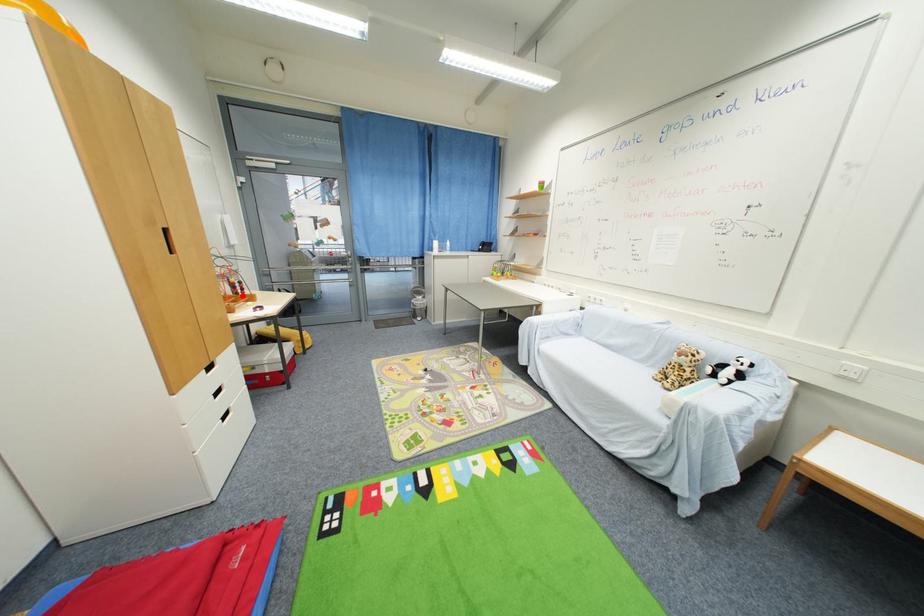
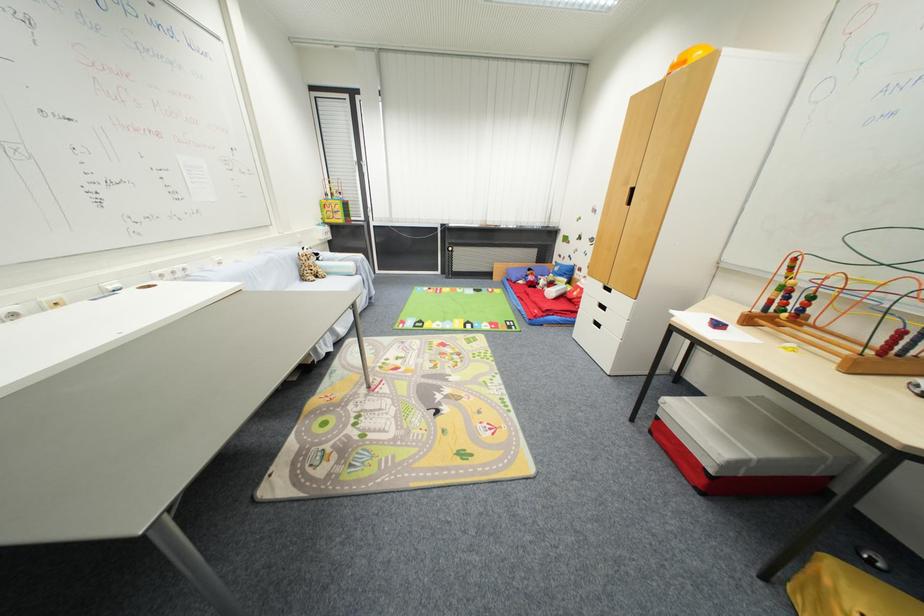
Locate, in the second image, the point that corresponds to the highlighted location in the first image.

(789, 313)